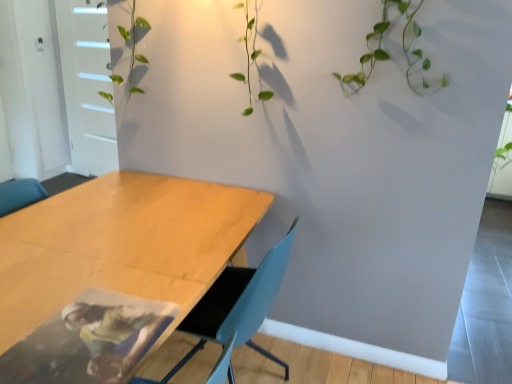
Locate an element on the screen. The height and width of the screenshot is (384, 512). empty space that is ontop of wooden table at lower left (from a real-world perspective) is located at coordinates (116, 235).